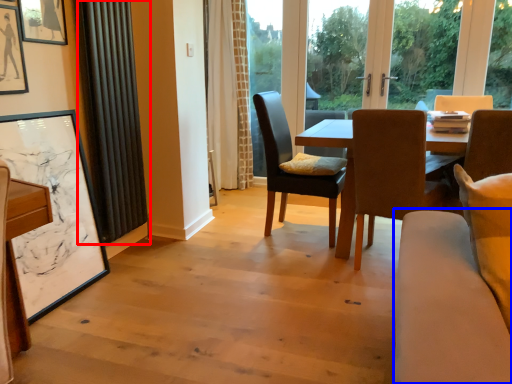
Question: Among these objects, which one is farthest to the camera, curtain (highlighted by a red box) or couch (highlighted by a blue box)?

Choices:
 (A) curtain
 (B) couch

Answer: (A)